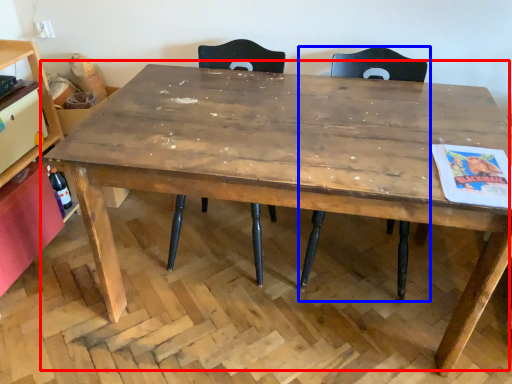
Question: Which of the following is the farthest to the observer, table (highlighted by a red box) or chair (highlighted by a blue box)?

Choices:
 (A) table
 (B) chair

Answer: (B)